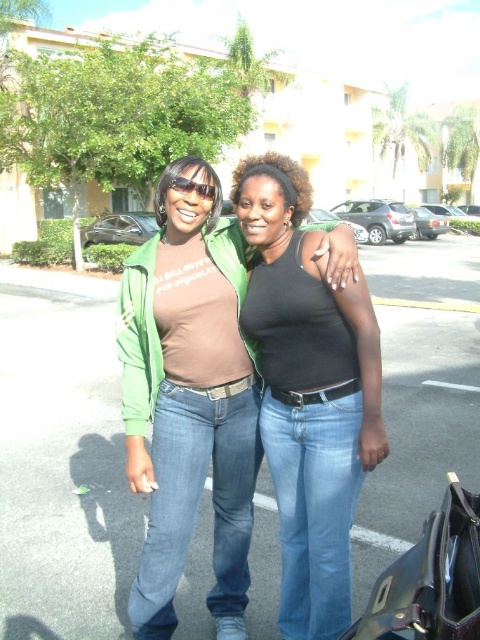
Question: Which point is farther to the camera?

Choices:
 (A) (294, 164)
 (B) (322, 346)

Answer: (A)

Question: Can you confirm if matte green jacket at center is wider than dark brown curly hair at center?

Choices:
 (A) yes
 (B) no

Answer: (B)

Question: Which of these objects is positioned closest to the dark brown curly hair at center?

Choices:
 (A) blue jeans at center
 (B) black matte tank top at center

Answer: (B)

Question: Does blue jeans at center appear on the right side of matte green jacket at center?

Choices:
 (A) no
 (B) yes

Answer: (A)

Question: Which point is closer to the camera?

Choices:
 (A) blue jeans at center
 (B) black matte tank top at center
 (C) matte green jacket at center

Answer: (B)

Question: Is matte green jacket at center to the left of dark brown curly hair at center from the viewer's perspective?

Choices:
 (A) no
 (B) yes

Answer: (B)